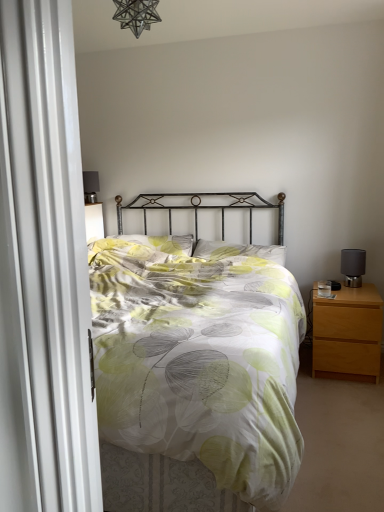
Find the location of a particular element. This screenshot has height=512, width=384. vacant space in front of matte black table lamp at right is located at coordinates (363, 288).